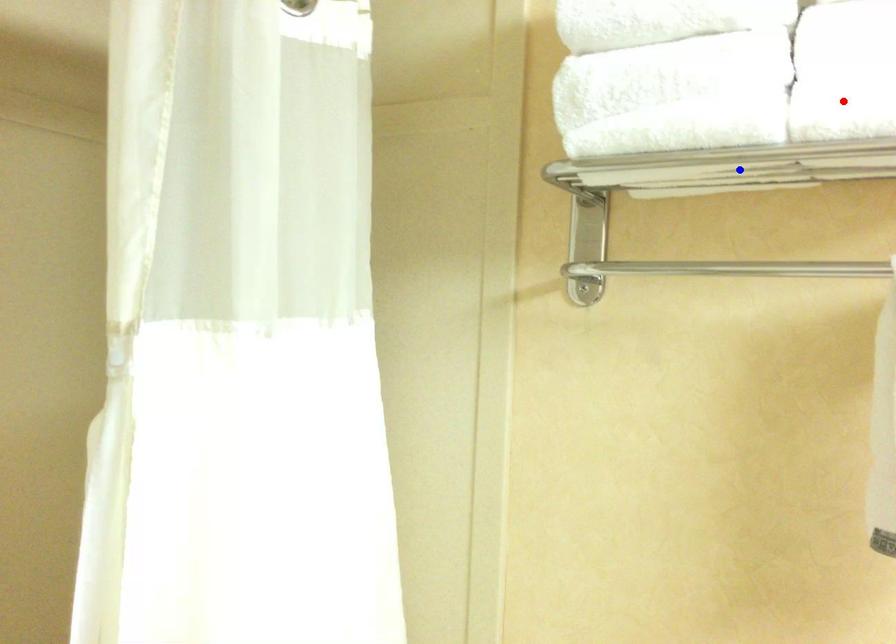
Question: Which of the two points in the image is closer to the camera?

Choices:
 (A) Blue point is closer.
 (B) Red point is closer.

Answer: (B)